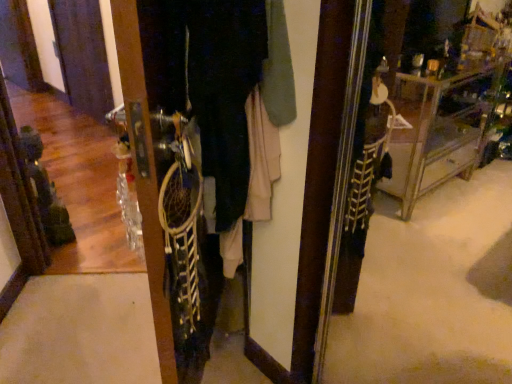
What is the approximate height of white fabric dreamcatcher at center?

white fabric dreamcatcher at center is 30.67 inches in height.

Find the location of a particular element. The image size is (512, 384). white fabric dreamcatcher at center is located at coordinates (155, 147).

This screenshot has height=384, width=512. Describe the element at coordinates (155, 147) in the screenshot. I see `white fabric dreamcatcher at center` at that location.

Image resolution: width=512 pixels, height=384 pixels. What do you see at coordinates (82, 55) in the screenshot?
I see `matte black screen door at left` at bounding box center [82, 55].

Image resolution: width=512 pixels, height=384 pixels. Find the location of `matte black screen door at left`. matte black screen door at left is located at coordinates (82, 55).

In order to face matte black screen door at left, should I rotate leftwards or rightwards?

Rotate your view left by about 22.294°.

In order to click on white fabric dreamcatcher at center in this screenshot , I will do `click(155, 147)`.

Would you say matte black screen door at left is to the left or to the right of white fabric dreamcatcher at center in the picture?

Clearly, matte black screen door at left is on the left of white fabric dreamcatcher at center in the image.

Which object is closer to the camera taking this photo, matte black screen door at left or white fabric dreamcatcher at center?

white fabric dreamcatcher at center is more forward.

Which point is more distant from viewer, (82, 95) or (141, 201)?

The point (82, 95) is farther from the camera.

From the image's perspective, between matte black screen door at left and white fabric dreamcatcher at center, which one is located above?

From the image's view, matte black screen door at left is above.

From a real-world perspective, who is located lower, matte black screen door at left or white fabric dreamcatcher at center?

matte black screen door at left is physically lower.

Which of these two, matte black screen door at left or white fabric dreamcatcher at center, is wider?

white fabric dreamcatcher at center is wider.

Can you confirm if matte black screen door at left is shorter than white fabric dreamcatcher at center?

In fact, matte black screen door at left may be taller than white fabric dreamcatcher at center.

Is matte black screen door at left bigger or smaller than white fabric dreamcatcher at center?

Clearly, matte black screen door at left is smaller in size than white fabric dreamcatcher at center.

Is matte black screen door at left inside the boundaries of white fabric dreamcatcher at center, or outside?

matte black screen door at left cannot be found inside white fabric dreamcatcher at center.

Is matte black screen door at left in contact with white fabric dreamcatcher at center?

matte black screen door at left and white fabric dreamcatcher at center are not in contact.

Is matte black screen door at left oriented towards white fabric dreamcatcher at center?

No, matte black screen door at left is not turned towards white fabric dreamcatcher at center.

Can you tell me how much matte black screen door at left and white fabric dreamcatcher at center differ in facing direction?

They differ by 134 degrees in their facing directions.

The width and height of the screenshot is (512, 384). What are the coordinates of `closet lying in front of the matte black screen door at left` in the screenshot? It's located at (155, 147).

In the scene shown: Which object is positioned more to the right, white fabric dreamcatcher at center or matte black screen door at left?

Positioned to the right is white fabric dreamcatcher at center.

Considering the relative positions of white fabric dreamcatcher at center and matte black screen door at left in the image provided, is white fabric dreamcatcher at center in front of matte black screen door at left?

Yes.

Which is in front, point (199, 261) or point (60, 8)?

The point (199, 261) is closer to the camera.

From the image's perspective, which is above, white fabric dreamcatcher at center or matte black screen door at left?

matte black screen door at left appears higher in the image.

From a real-world perspective, is white fabric dreamcatcher at center located higher than matte black screen door at left?

Correct, in the physical world, white fabric dreamcatcher at center is higher than matte black screen door at left.

Which of these two, white fabric dreamcatcher at center or matte black screen door at left, is wider?

white fabric dreamcatcher at center is wider.

Which of these two, white fabric dreamcatcher at center or matte black screen door at left, stands taller?

matte black screen door at left is taller.

Can you confirm if white fabric dreamcatcher at center is smaller than matte black screen door at left?

Incorrect, white fabric dreamcatcher at center is not smaller in size than matte black screen door at left.

Would you say white fabric dreamcatcher at center contains matte black screen door at left?

Answer: Actually, matte black screen door at left is outside white fabric dreamcatcher at center.

Are white fabric dreamcatcher at center and matte black screen door at left making contact?

No, white fabric dreamcatcher at center is not in contact with matte black screen door at left.

Is white fabric dreamcatcher at center turned away from matte black screen door at left?

That's not correct — white fabric dreamcatcher at center is not looking away from matte black screen door at left.

How much distance is there between white fabric dreamcatcher at center and matte black screen door at left?

8.64 feet.

At what (x,y) coordinates should I click in order to perform the action: click on screen door located on the left of white fabric dreamcatcher at center. Please return your answer as a coordinate pair (x, y). Looking at the image, I should click on (82, 55).

Locate an element on the screen. The image size is (512, 384). closet that appears in front of the matte black screen door at left is located at coordinates (155, 147).

Locate an element on the screen. The width and height of the screenshot is (512, 384). closet lying below the matte black screen door at left (from the image's perspective) is located at coordinates (155, 147).